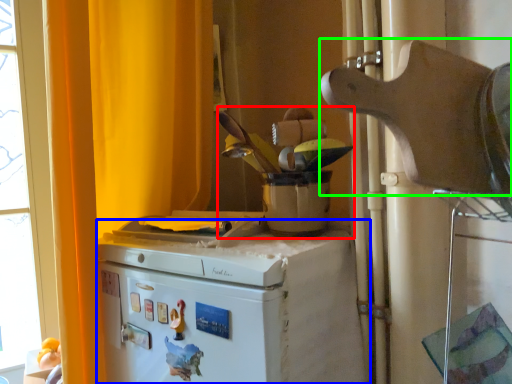
Question: Based on their relative distances, which object is farther from appliance (highlighted by a red box)? Choose from home appliance (highlighted by a blue box) and appliance (highlighted by a green box).

Choices:
 (A) home appliance
 (B) appliance

Answer: (B)